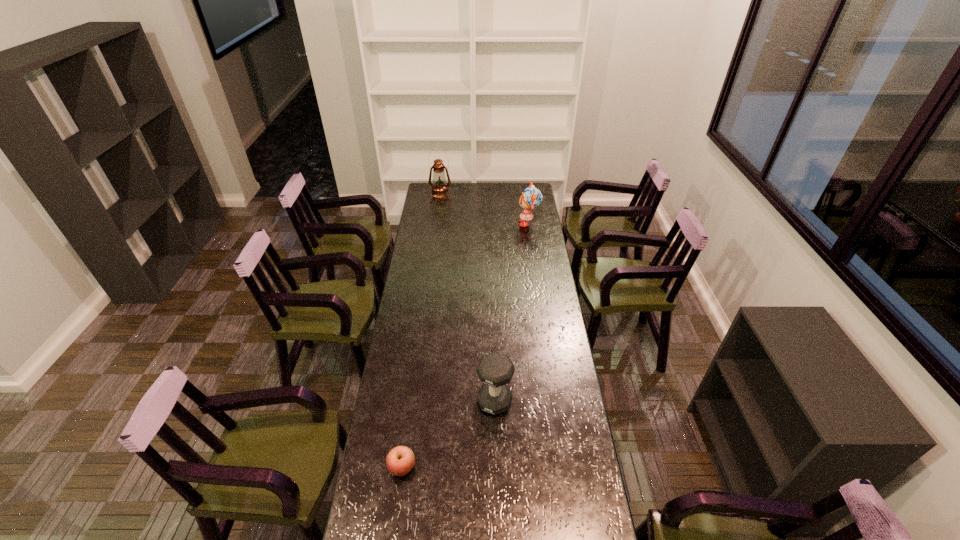
At what (x,y) coordinates should I click in order to perform the action: click on vacant space in between the second farthest object and the nearest object. Please return your answer as a coordinate pair (x, y). This screenshot has width=960, height=540. Looking at the image, I should click on (466, 345).

Where is `vacant area between the third object from left to right and the oil lamp`? Image resolution: width=960 pixels, height=540 pixels. vacant area between the third object from left to right and the oil lamp is located at coordinates (468, 297).

Identify which object is the second nearest to the oil lamp. Please provide its 2D coordinates. Your answer should be formatted as a tuple, i.e. [(x, y)], where the tuple contains the x and y coordinates of a point satisfying the conditions above.

[(495, 370)]

Locate which object ranks second in proximity to the third object from left to right. Please provide its 2D coordinates. Your answer should be formatted as a tuple, i.e. [(x, y)], where the tuple contains the x and y coordinates of a point satisfying the conditions above.

[(531, 198)]

Identify the location of free location that satisfies the following two spatial constraints: 1. on the face of the doll; 2. on the front side of the dumbbell. pyautogui.click(x=556, y=401).